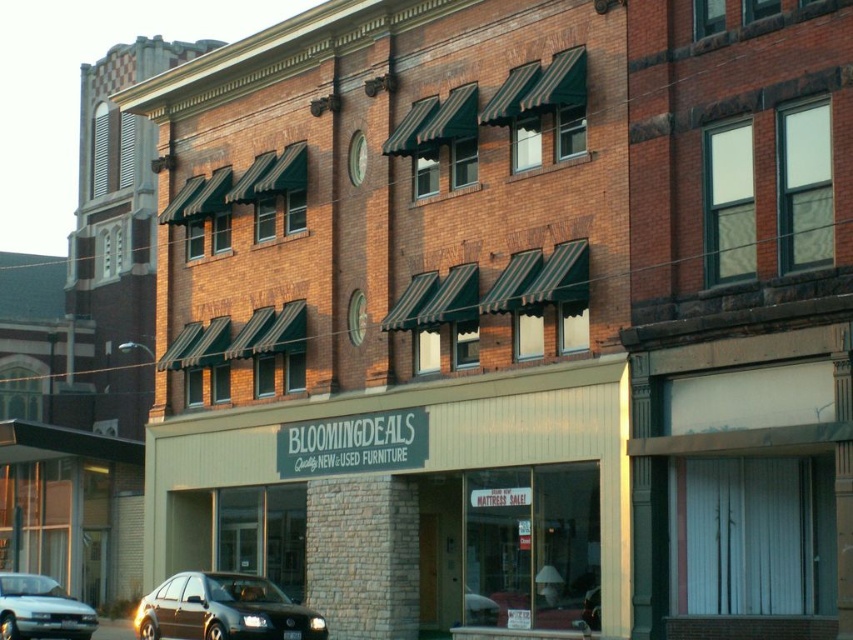
You are a delivery person trying to park a 15.5 feet long truck between the satin black sedan at lower left and the silver metallic sedan at lower left. Is there enough space for the truck?

The satin black sedan at lower left is 16.07 feet away from the silver metallic sedan at lower left. Since the truck is 15.5 feet long, it can fit between them as there is sufficient space.

You are a delivery driver who needs to back out of the parking spot in front of the BLOOMINGDEALS store. You see a satin black sedan at lower left and a silver metallic sedan at lower left. Which car is positioned higher up relative to the storefront, and would that affect your backing out?

The satin black sedan at lower left is located above the silver metallic sedan at lower left. Since it is higher up, this might mean it is parked closer to the storefront, potentially blocking your path when backing out. You should check for any obstructions caused by the satin black sedan at lower left before proceeding.